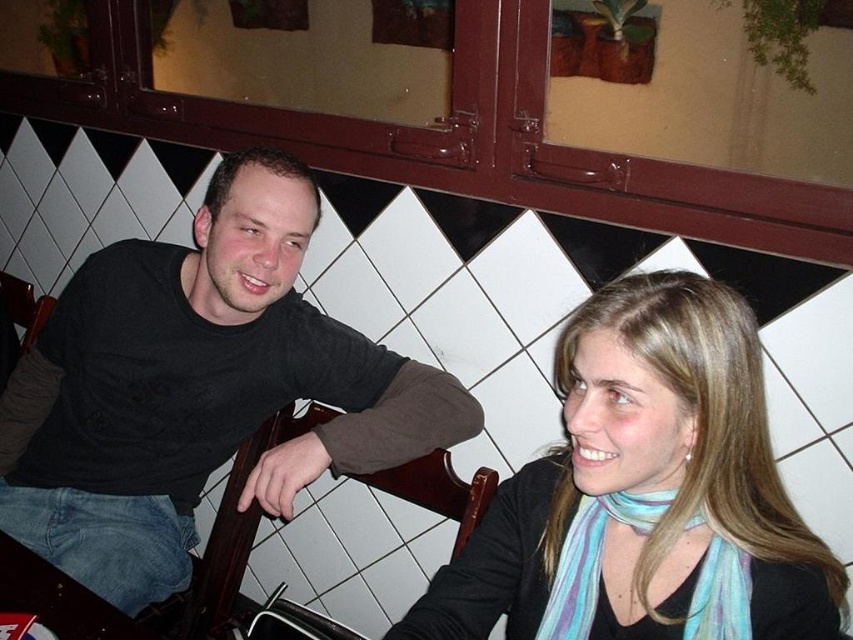
You are a photographer trying to capture a portrait of the two people at the table. You want to ensure that both the black cotton shirt at center and the light blue scarf at center are clearly visible in the frame. Based on their positions, which item is closer to the left side of the photo?

The black cotton shirt at center is positioned to the left of the light blue scarf at center, so it will appear closer to the left side of the photo.

You are a photographer trying to capture a closeup of the black cotton shirt at center and the light blue scarf at center in the scene. Since both are at the center, which one will appear bigger in the photo?

The black cotton shirt at center is larger in size than the light blue scarf at center, so it will appear bigger in the photo.

What object is located at the coordinates point (198, 388)?

The point (198, 388) indicates the location of the black cotton shirt at center.